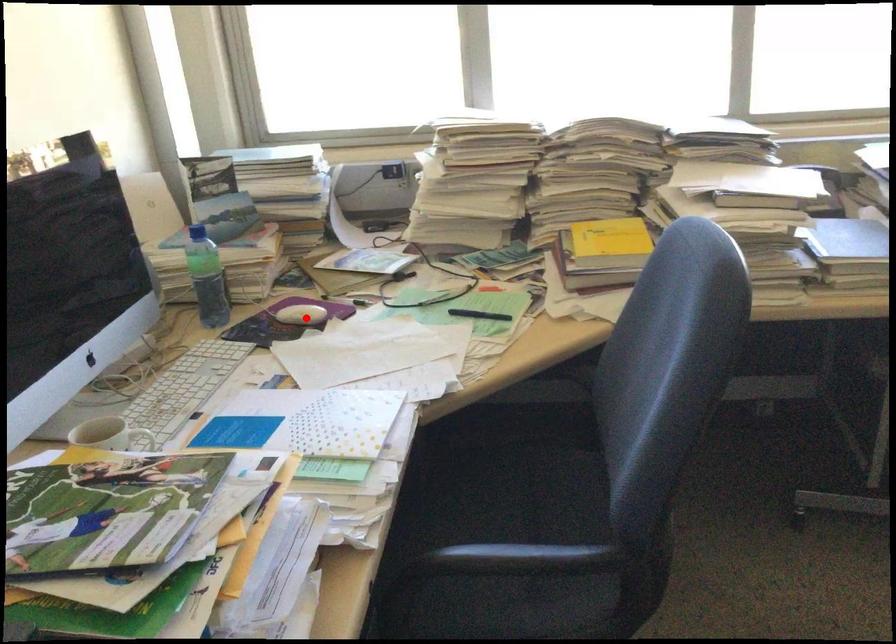
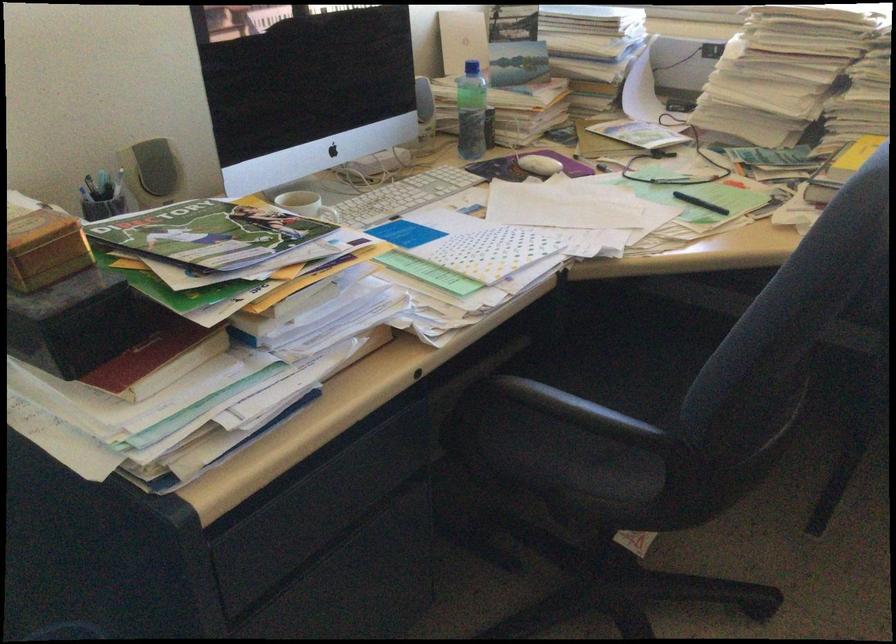
Question: I am providing you with two images of the same scene from different viewpoints. A red point is marked on the first image. At the location where the point appears in image 1, is it still visible in image 2?

Choices:
 (A) Yes
 (B) No

Answer: (A)